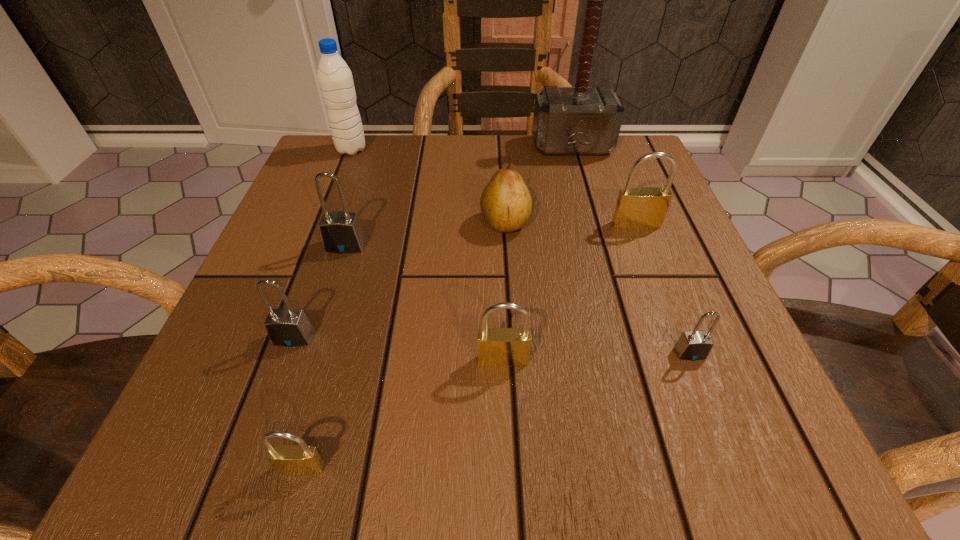
At what (x,y) coordinates should I click in order to perform the action: click on vacant space that's between the rightmost gray padlock and the pear. Please return your answer as a coordinate pair (x, y). Looking at the image, I should click on (597, 288).

You are a GUI agent. You are given a task and a screenshot of the screen. Output one action in this format:
    pyautogui.click(x=<x>, y=<y>)
    Task: Click on the unoccupied position between the gray water bottle and the nearest padlock
    
    Given the screenshot: What is the action you would take?
    pyautogui.click(x=326, y=309)

This screenshot has height=540, width=960. In order to click on vacant point located between the brown pear and the eighth shortest object in this screenshot , I will do `click(428, 186)`.

Where is `free spot between the hammer and the second nearest brass padlock`? This screenshot has height=540, width=960. free spot between the hammer and the second nearest brass padlock is located at coordinates (538, 253).

Find the location of a particular element. This screenshot has height=540, width=960. vacant region between the gray water bottle and the leftmost brass padlock is located at coordinates (326, 309).

Select which object is the third closest to the rightmost gray padlock. Please provide its 2D coordinates. Your answer should be formatted as a tuple, i.e. [(x, y)], where the tuple contains the x and y coordinates of a point satisfying the conditions above.

[(506, 203)]

At what (x,y) coordinates should I click in order to perform the action: click on object that stands as the second closest to the rightmost gray padlock. Please return your answer as a coordinate pair (x, y). This screenshot has height=540, width=960. Looking at the image, I should click on (637, 207).

Point out which padlock is positioned as the fourth nearest to the biggest brass padlock. Please provide its 2D coordinates. Your answer should be formatted as a tuple, i.e. [(x, y)], where the tuple contains the x and y coordinates of a point satisfying the conditions above.

[(288, 327)]

Locate an element on the screen. The width and height of the screenshot is (960, 540). padlock identified as the closest to the leftmost brass padlock is located at coordinates (288, 327).

Where is `the closest gray padlock to the fifth nearest padlock`? This screenshot has width=960, height=540. the closest gray padlock to the fifth nearest padlock is located at coordinates (288, 327).